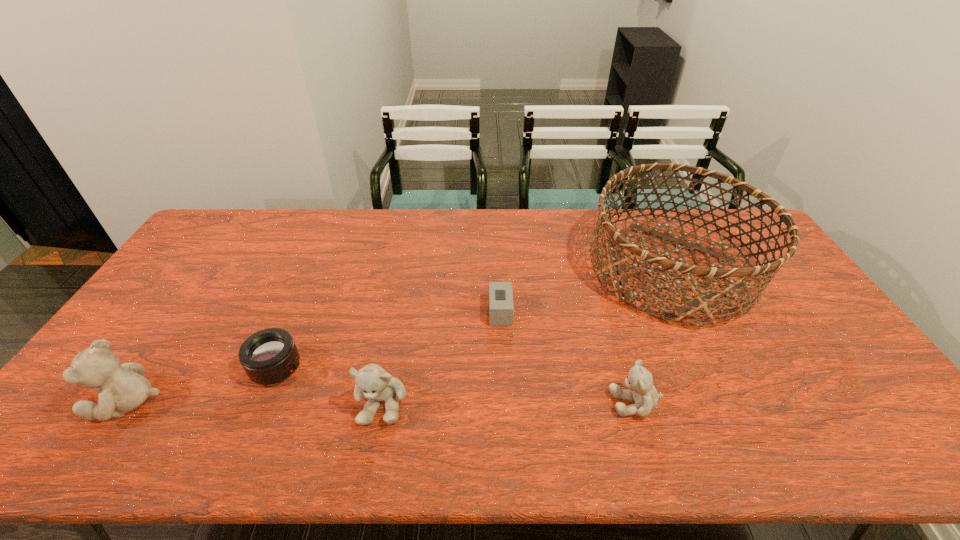
Image resolution: width=960 pixels, height=540 pixels. What are the coordinates of `free space located 0.220m on the face of the rightmost teddy bear` in the screenshot? It's located at (520, 403).

The image size is (960, 540). I want to click on vacant space situated 0.370m on the face of the rightmost teddy bear, so click(x=459, y=403).

Identify the location of vacant region located on the face of the rightmost teddy bear. (528, 403).

You are a GUI agent. You are given a task and a screenshot of the screen. Output one action in this format:
    pyautogui.click(x=<x>, y=<y>)
    Task: Click on the free spot located on the front of the basket
    The height and width of the screenshot is (540, 960).
    Given the screenshot: What is the action you would take?
    (732, 399)

You are a GUI agent. You are given a task and a screenshot of the screen. Output one action in this format:
    pyautogui.click(x=<x>, y=<y>)
    Task: Click on the blank space located 0.140m on the front-facing side of the fourth object from left to right
    The width and height of the screenshot is (960, 540).
    Given the screenshot: What is the action you would take?
    pyautogui.click(x=442, y=312)

Where is `blank area located 0.340m on the front-facing side of the fourth object from left to right`? blank area located 0.340m on the front-facing side of the fourth object from left to right is located at coordinates (374, 312).

Find the location of `vacant space situated on the front-facing side of the fourth object from left to right`. vacant space situated on the front-facing side of the fourth object from left to right is located at coordinates (411, 312).

I want to click on vacant space located 0.140m on the side of the telephoto lens with brand markings and control switches, so 355,368.

I want to click on object that is positioned at the far edge, so click(x=702, y=297).

Where is `telephoto lens at the near edge`? Image resolution: width=960 pixels, height=540 pixels. telephoto lens at the near edge is located at coordinates (269, 356).